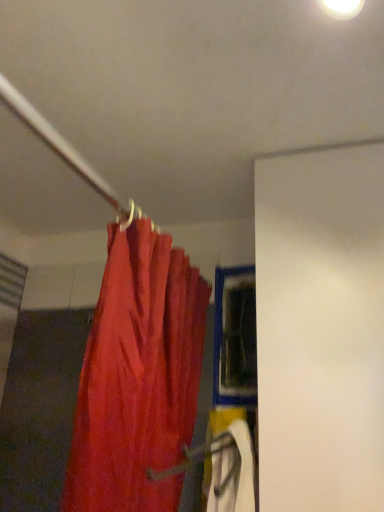
Question: Considering the relative positions of blue plastic window at center and matte red curtain at upper left in the image provided, is blue plastic window at center to the right of matte red curtain at upper left from the viewer's perspective?

Choices:
 (A) no
 (B) yes

Answer: (B)

Question: Is blue plastic window at center wider than matte red curtain at upper left?

Choices:
 (A) yes
 (B) no

Answer: (B)

Question: Considering the relative sizes of blue plastic window at center and matte red curtain at upper left in the image provided, is blue plastic window at center thinner than matte red curtain at upper left?

Choices:
 (A) yes
 (B) no

Answer: (A)

Question: Is blue plastic window at center behind matte red curtain at upper left?

Choices:
 (A) no
 (B) yes

Answer: (B)

Question: Is matte red curtain at upper left at the back of blue plastic window at center?

Choices:
 (A) yes
 (B) no

Answer: (B)

Question: Is blue plastic window at center with matte red curtain at upper left?

Choices:
 (A) no
 (B) yes

Answer: (A)

Question: Is there a large distance between matte red curtain at upper left and blue plastic window at center?

Choices:
 (A) yes
 (B) no

Answer: (B)

Question: From a real-world perspective, is matte red curtain at upper left beneath blue plastic window at center?

Choices:
 (A) yes
 (B) no

Answer: (A)

Question: Is matte red curtain at upper left bigger than blue plastic window at center?

Choices:
 (A) yes
 (B) no

Answer: (A)

Question: Can you confirm if matte red curtain at upper left is positioned to the right of blue plastic window at center?

Choices:
 (A) no
 (B) yes

Answer: (A)

Question: Can you confirm if matte red curtain at upper left is shorter than blue plastic window at center?

Choices:
 (A) no
 (B) yes

Answer: (A)

Question: Does matte red curtain at upper left have a greater height compared to blue plastic window at center?

Choices:
 (A) no
 (B) yes

Answer: (B)

Question: Is blue plastic window at center to the left or to the right of matte red curtain at upper left in the image?

Choices:
 (A) left
 (B) right

Answer: (B)